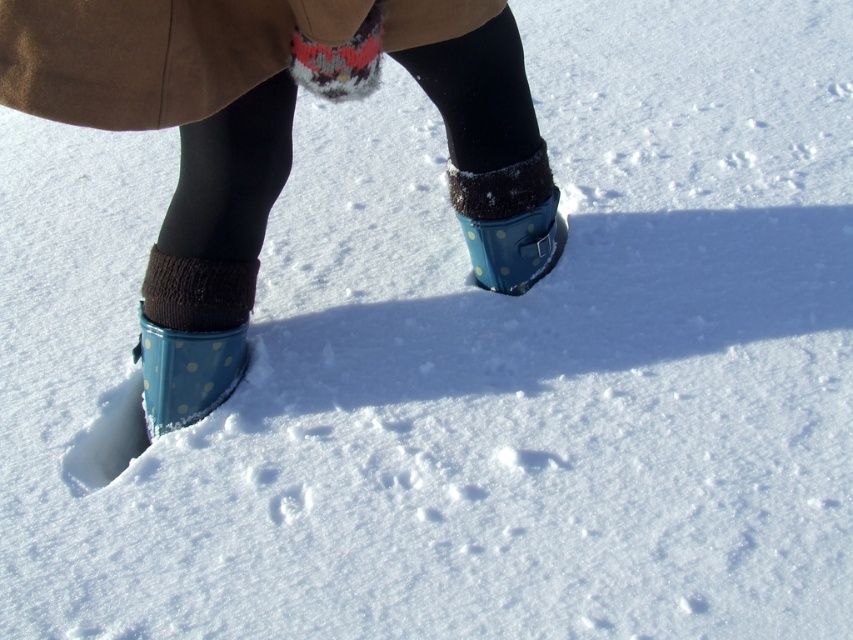
Question: Estimate the real-world distances between objects in this image. Which object is farther from the blue polka dot rubber boot at lower left?

Choices:
 (A) blue polka dot rubber boots at center
 (B) blue polka dot rubber boot at center

Answer: (B)

Question: Which point is closer to the camera?

Choices:
 (A) (514, 177)
 (B) (161, 401)

Answer: (B)

Question: Is blue polka dot rubber boots at center to the left of blue polka dot rubber boot at center from the viewer's perspective?

Choices:
 (A) no
 (B) yes

Answer: (B)

Question: Does blue polka dot rubber boots at center come behind brown woolen trench coat at upper center?

Choices:
 (A) yes
 (B) no

Answer: (A)

Question: Is blue polka dot rubber boots at center above blue polka dot rubber boot at lower left?

Choices:
 (A) no
 (B) yes

Answer: (B)

Question: Based on their relative distances, which object is farther from the blue polka dot rubber boot at center?

Choices:
 (A) blue polka dot rubber boot at lower left
 (B) brown woolen trench coat at upper center

Answer: (A)